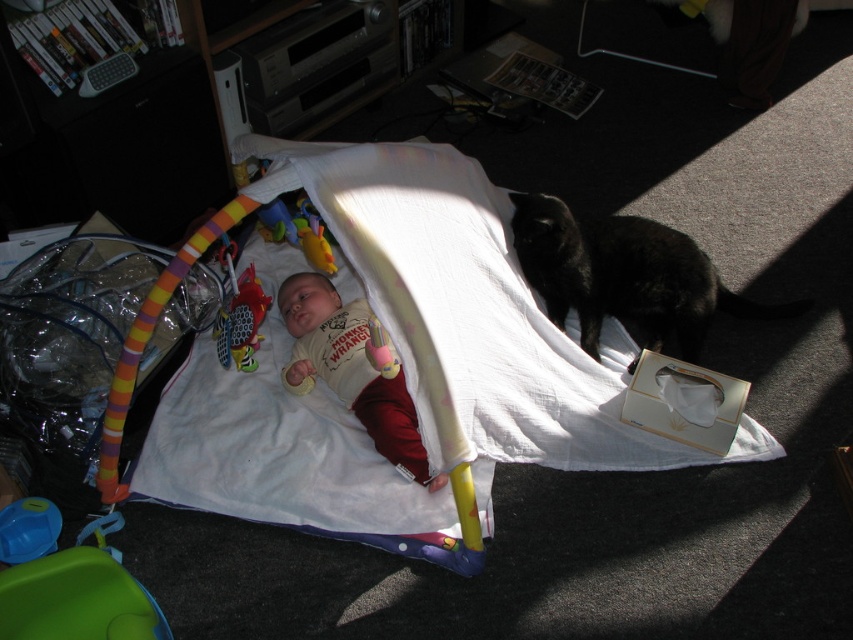
Question: Which of the following is the farthest from the observer?

Choices:
 (A) (590, 349)
 (B) (436, 538)
 (C) (381, 372)
 (D) (21, 508)

Answer: (A)

Question: Does rubberized plastic toy at center lie behind blue plastic toy at lower left?

Choices:
 (A) yes
 (B) no

Answer: (A)

Question: Is black fluffy cat at right wider than rubberized plastic toy at center?

Choices:
 (A) no
 (B) yes

Answer: (B)

Question: Does white soft fabric at center lie behind rubberized plastic toy at center?

Choices:
 (A) no
 (B) yes

Answer: (A)

Question: Which is nearer to the black fluffy cat at right?

Choices:
 (A) white soft baby at center
 (B) blue plastic toy at lower left

Answer: (A)

Question: Which of the following is the closest to the observer?

Choices:
 (A) (49, 544)
 (B) (537, 260)

Answer: (A)